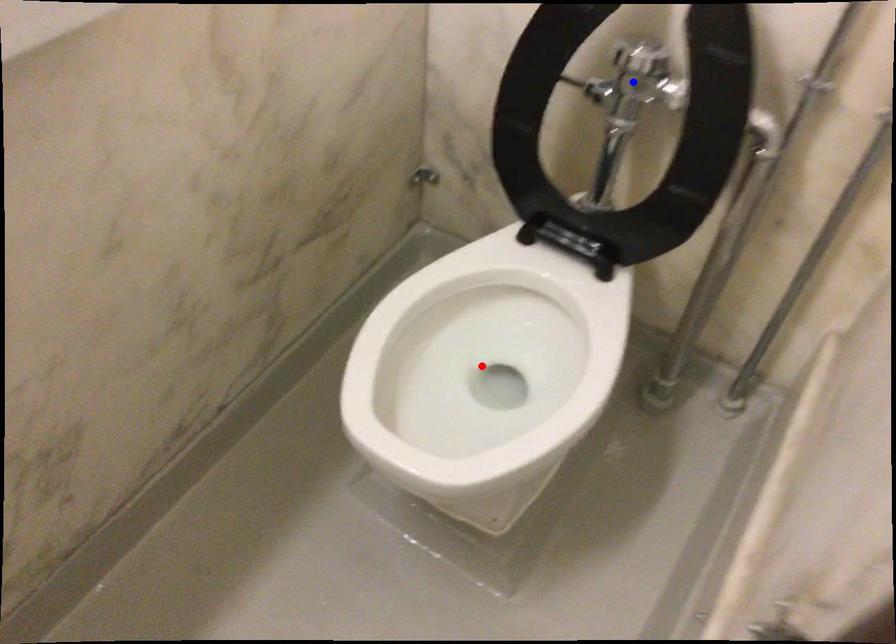
Question: Which of the two points in the image is closer to the camera?

Choices:
 (A) Blue point is closer.
 (B) Red point is closer.

Answer: (A)